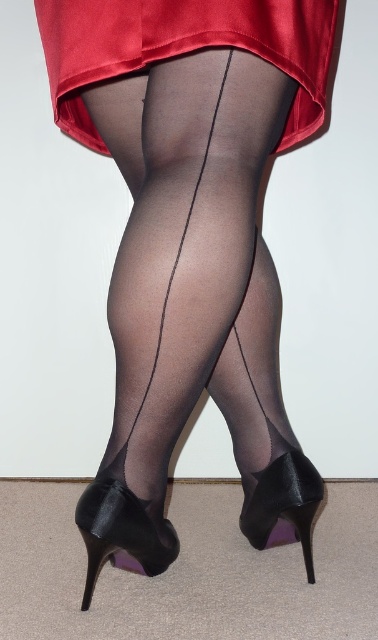
Question: Which is farther from the shiny black high-heeled shoe at lower center?

Choices:
 (A) black satin shoe at lower center
 (B) satin dress at upper center

Answer: (B)

Question: Can you confirm if satin dress at upper center is positioned above black satin shoe at lower center?

Choices:
 (A) no
 (B) yes

Answer: (B)

Question: Does black satin shoe at lower center lie in front of shiny black high-heeled shoe at lower center?

Choices:
 (A) no
 (B) yes

Answer: (B)

Question: Which point is closer to the camera?

Choices:
 (A) (139, 45)
 (B) (131, 515)

Answer: (A)

Question: Which of the following is the farthest from the observer?

Choices:
 (A) (92, 541)
 (B) (254, 532)
 (C) (102, 148)

Answer: (B)

Question: Does black satin shoe at lower center lie behind shiny black high-heeled shoe at lower center?

Choices:
 (A) no
 (B) yes

Answer: (A)